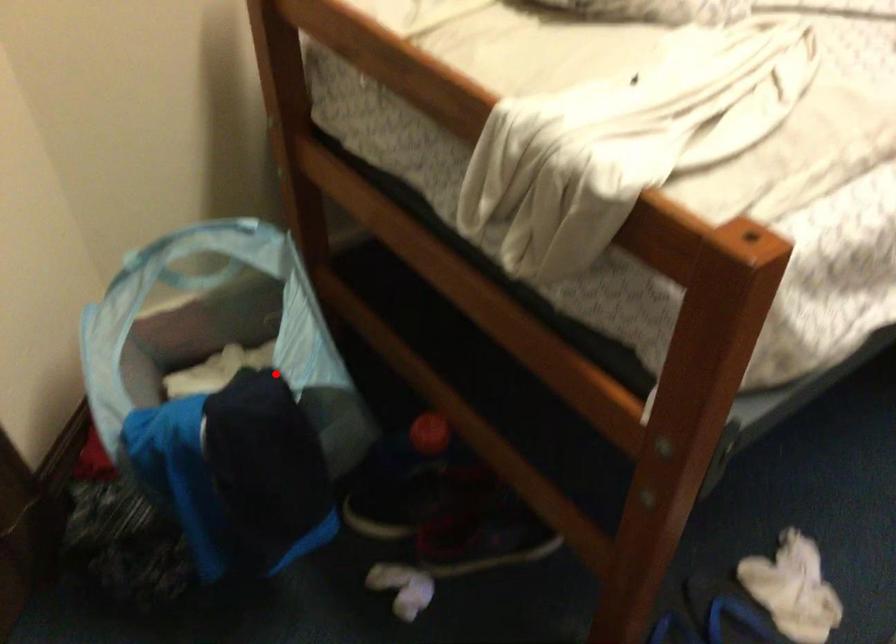
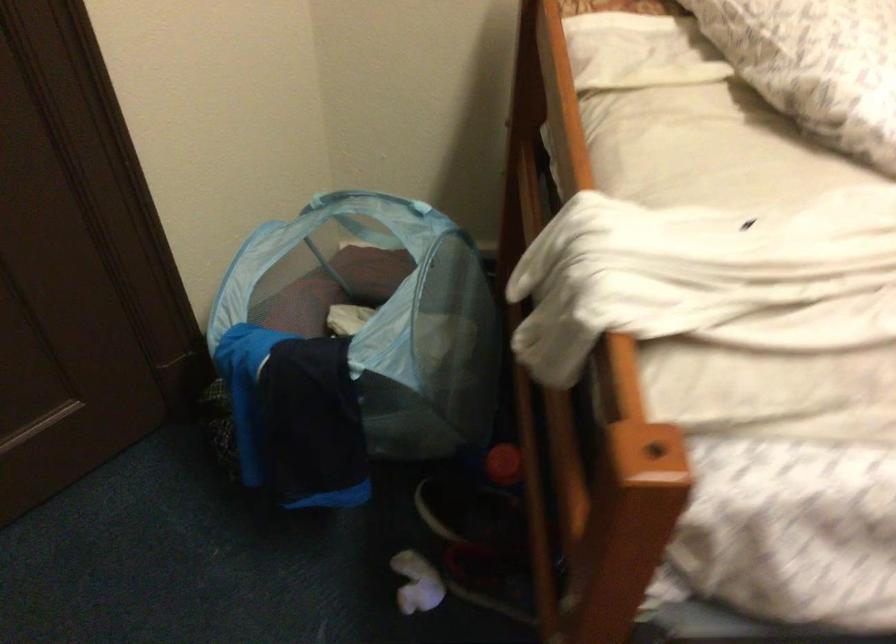
Question: I am providing you with two images of the same scene from different viewpoints. Image1 has a red point marked. In image2, the corresponding 3D location appears at what relative position? Reply with the corresponding letter.

Choices:
 (A) Closer
 (B) Farther

Answer: (B)